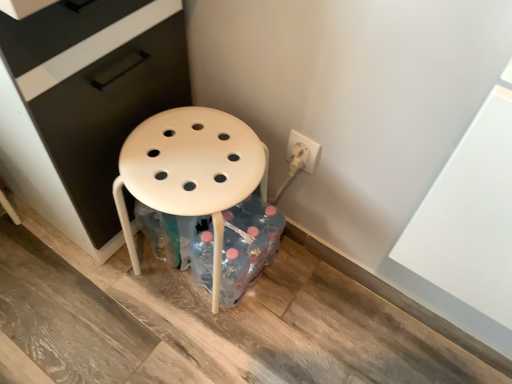
Identify the location of white plastic stool at center. This screenshot has height=384, width=512. (191, 171).

At what (x,y) coordinates should I click in order to perform the action: click on matte black file cabinet at center. Please return your answer as a coordinate pair (x, y). The width and height of the screenshot is (512, 384). Looking at the image, I should click on (84, 104).

Identify the location of translucent plastic bottles at lower center. The height and width of the screenshot is (384, 512). (247, 246).

Locate an element on the screen. white plastic stool at center is located at coordinates (191, 171).

Is white plastic stool at center completely or partially outside of white plastic outlet at right?

white plastic stool at center is positioned outside white plastic outlet at right.

Looking at this image, are white plastic stool at center and white plastic outlet at right located far from each other?

white plastic stool at center is actually quite close to white plastic outlet at right.

From a real-world perspective, is white plastic stool at center physically above white plastic outlet at right?

No.

How different are the orientations of white plastic stool at center and white plastic outlet at right in degrees?

4.22 degrees.

Is matte black file cabinet at center in front of or behind translucent plastic bottles at lower center in the image?

In the image, matte black file cabinet at center appears in front of translucent plastic bottles at lower center.

From the image's perspective, is matte black file cabinet at center located above or below translucent plastic bottles at lower center?

matte black file cabinet at center is situated higher than translucent plastic bottles at lower center in the image.

Which of these two, matte black file cabinet at center or translucent plastic bottles at lower center, is thinner?

translucent plastic bottles at lower center is thinner.

The image size is (512, 384). I want to click on bottle behind the matte black file cabinet at center, so click(x=247, y=246).

From the image's perspective, which is below, matte black file cabinet at center or white plastic outlet at right?

From the image's view, white plastic outlet at right is below.

Between matte black file cabinet at center and white plastic outlet at right, which one is positioned in front?

Positioned in front is matte black file cabinet at center.

From a real-world perspective, relative to white plastic outlet at right, is matte black file cabinet at center vertically above or below?

Clearly, from a real-world perspective, matte black file cabinet at center is above white plastic outlet at right.

Is matte black file cabinet at center at the left side of white plastic outlet at right?

Indeed, matte black file cabinet at center is positioned on the left side of white plastic outlet at right.

From a real-world perspective, which is physically above, matte black file cabinet at center or white plastic stool at center?

In real-world perspective, matte black file cabinet at center is above.

From the image's perspective, would you say matte black file cabinet at center is shown under white plastic stool at center?

No, from the image's perspective, matte black file cabinet at center is not below white plastic stool at center.

Does matte black file cabinet at center turn towards white plastic stool at center?

No, matte black file cabinet at center is not facing towards white plastic stool at center.

Locate an element on the screen. file cabinet in front of the white plastic stool at center is located at coordinates (84, 104).

Consider the image. From the image's perspective, which object appears higher, white plastic outlet at right or white plastic stool at center?

white plastic outlet at right, from the image's perspective.

From a real-world perspective, is white plastic outlet at right above or below white plastic stool at center?

In terms of real-world spatial position, white plastic outlet at right is above white plastic stool at center.

Consider the image. Is white plastic outlet at right bigger than white plastic stool at center?

Actually, white plastic outlet at right might be smaller than white plastic stool at center.

Is white plastic stool at center touching translucent plastic bottles at lower center?

white plastic stool at center is not next to translucent plastic bottles at lower center, and they're not touching.

Is white plastic stool at center shorter than translucent plastic bottles at lower center?

No, white plastic stool at center is not shorter than translucent plastic bottles at lower center.

From the image's perspective, would you say white plastic stool at center is positioned over translucent plastic bottles at lower center?

A: Indeed, from the image's perspective, white plastic stool at center is shown above translucent plastic bottles at lower center.

From a real-world perspective, is white plastic stool at center positioned under translucent plastic bottles at lower center based on gravity?

Incorrect, from a real-world perspective, white plastic stool at center is higher than translucent plastic bottles at lower center.

Consider the image. Considering the sizes of objects translucent plastic bottles at lower center and white plastic outlet at right in the image provided, who is wider, translucent plastic bottles at lower center or white plastic outlet at right?

With larger width is translucent plastic bottles at lower center.

How many degrees apart are the facing directions of translucent plastic bottles at lower center and white plastic outlet at right?

The facing directions of translucent plastic bottles at lower center and white plastic outlet at right are 4.22 degrees apart.

Is translucent plastic bottles at lower center inside or outside of white plastic outlet at right?

translucent plastic bottles at lower center is not enclosed by white plastic outlet at right.

From the image's perspective, is translucent plastic bottles at lower center above or below white plastic outlet at right?

From the image's perspective, translucent plastic bottles at lower center appears below white plastic outlet at right.

In order to click on stool in front of the white plastic outlet at right in this screenshot , I will do `click(191, 171)`.

Image resolution: width=512 pixels, height=384 pixels. I want to click on bottle behind the matte black file cabinet at center, so click(x=247, y=246).

From the image, which object appears to be nearer to white plastic stool at center, translucent plastic bottles at lower center or white plastic outlet at right?

The object closer to white plastic stool at center is translucent plastic bottles at lower center.

When comparing their distances from matte black file cabinet at center, does white plastic stool at center or translucent plastic bottles at lower center seem further?

Based on the image, translucent plastic bottles at lower center appears to be further to matte black file cabinet at center.

From the image, which object appears to be farther from white plastic stool at center, white plastic outlet at right or matte black file cabinet at center?

white plastic outlet at right is positioned further to the anchor white plastic stool at center.

Estimate the real-world distances between objects in this image. Which object is further from matte black file cabinet at center, translucent plastic bottles at lower center or white plastic stool at center?

translucent plastic bottles at lower center is further to matte black file cabinet at center.

From the image, which object appears to be nearer to matte black file cabinet at center, white plastic outlet at right or white plastic stool at center?

white plastic stool at center lies closer to matte black file cabinet at center than the other object.

From the image, which object appears to be nearer to white plastic stool at center, matte black file cabinet at center or white plastic outlet at right?

matte black file cabinet at center is positioned closer to the anchor white plastic stool at center.

Looking at the image, which one is located closer to white plastic stool at center, translucent plastic bottles at lower center or matte black file cabinet at center?

Among the two, translucent plastic bottles at lower center is located nearer to white plastic stool at center.

From the image, which object appears to be farther from matte black file cabinet at center, translucent plastic bottles at lower center or white plastic outlet at right?

white plastic outlet at right is further to matte black file cabinet at center.

This screenshot has height=384, width=512. Find the location of `bottle between matte black file cabinet at center and white plastic outlet at right in the horizontal direction`. bottle between matte black file cabinet at center and white plastic outlet at right in the horizontal direction is located at coordinates (247, 246).

Find the location of `stool between matte black file cabinet at center and white plastic outlet at right from left to right`. stool between matte black file cabinet at center and white plastic outlet at right from left to right is located at coordinates (191, 171).

You are a GUI agent. You are given a task and a screenshot of the screen. Output one action in this format:
    pyautogui.click(x=<x>, y=<y>)
    Task: Click on the stool between matte black file cabinet at center and translucent plastic bottles at lower center in the front-back direction
    The image size is (512, 384).
    Given the screenshot: What is the action you would take?
    pyautogui.click(x=191, y=171)

You are a GUI agent. You are given a task and a screenshot of the screen. Output one action in this format:
    pyautogui.click(x=<x>, y=<y>)
    Task: Click on the bottle between white plastic stool at center and white plastic outlet at right from left to right
    
    Given the screenshot: What is the action you would take?
    pyautogui.click(x=247, y=246)